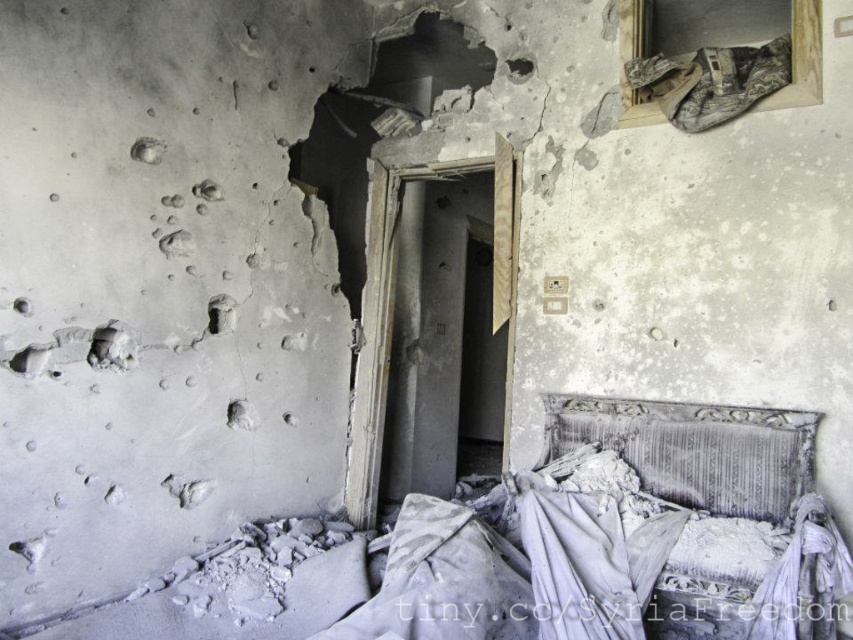
You are a firefighter entering this damaged bedroom to search for survivors. You see the charred fabric bed at lower right and the worn fabric pillow at lower right. Which object is closer to the floor?

The charred fabric bed at lower right is located below the worn fabric pillow at lower right, so it is closer to the floor.

You are a firefighter entering a damaged bedroom to search for survivors. You see the charred fabric bed at lower right and the worn fabric pillow at lower right. Which object should you avoid touching if you want to prevent further damage to the items?

You should avoid touching the charred fabric bed at lower right because it is bigger and more structurally compromised than the worn fabric pillow at lower right, making it more likely to cause further damage if disturbed.